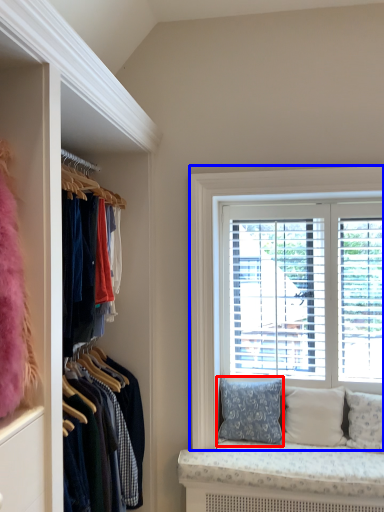
Question: Which of the following is the closest to the observer, pillow (highlighted by a red box) or window (highlighted by a blue box)?

Choices:
 (A) pillow
 (B) window

Answer: (A)